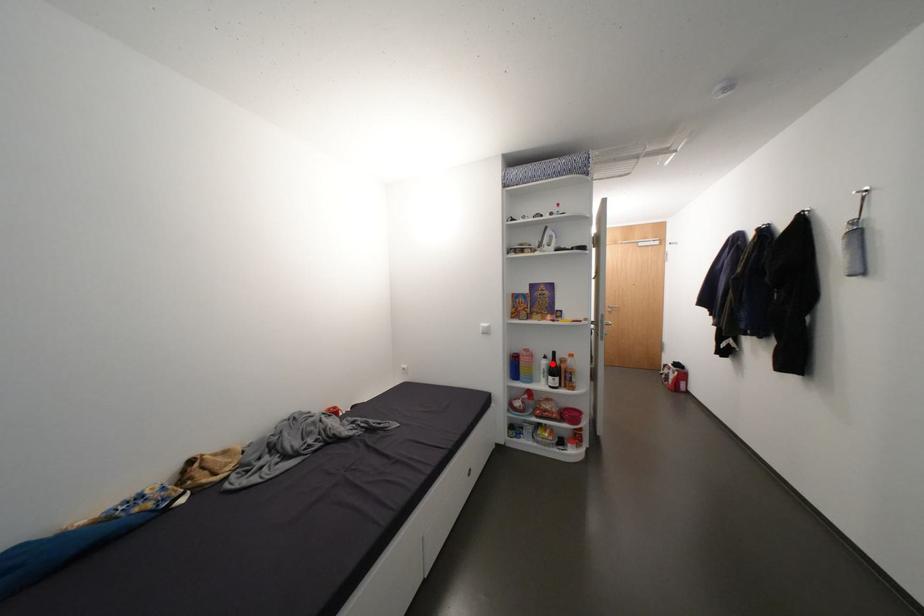
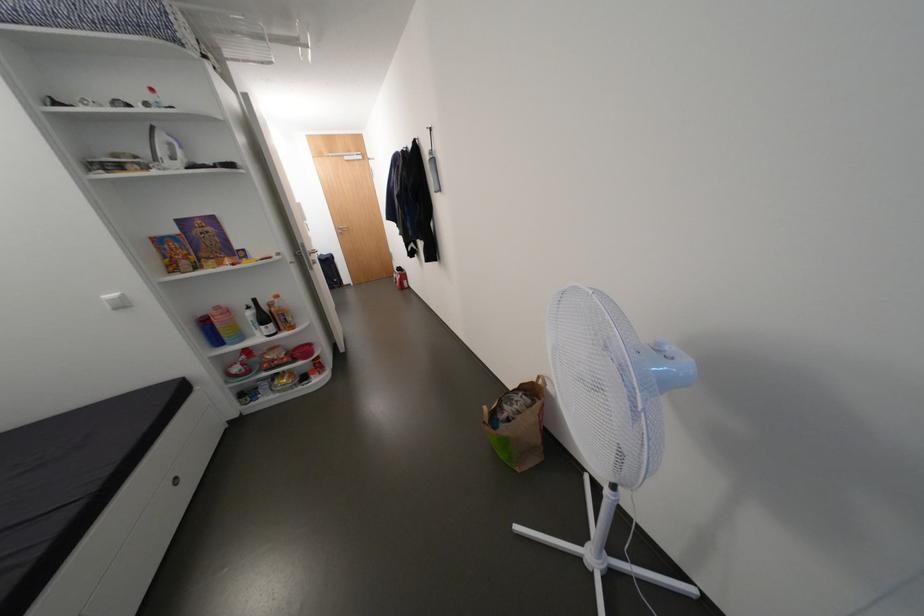
Question: I am providing you with two images of the same scene from different viewpoints. Given a red point in image1, look at the same physical point in image2. Is it:

Choices:
 (A) Closer to the viewpoint
 (B) Farther from the viewpoint

Answer: (A)